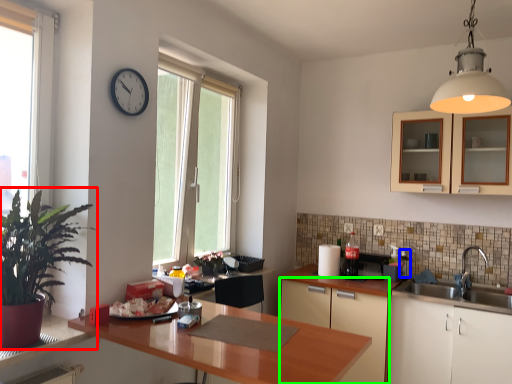
Question: Based on their relative distances, which object is farther from houseplant (highlighted by a red box)? Choose from appliance (highlighted by a blue box) and cabinetry (highlighted by a green box).

Choices:
 (A) appliance
 (B) cabinetry

Answer: (A)